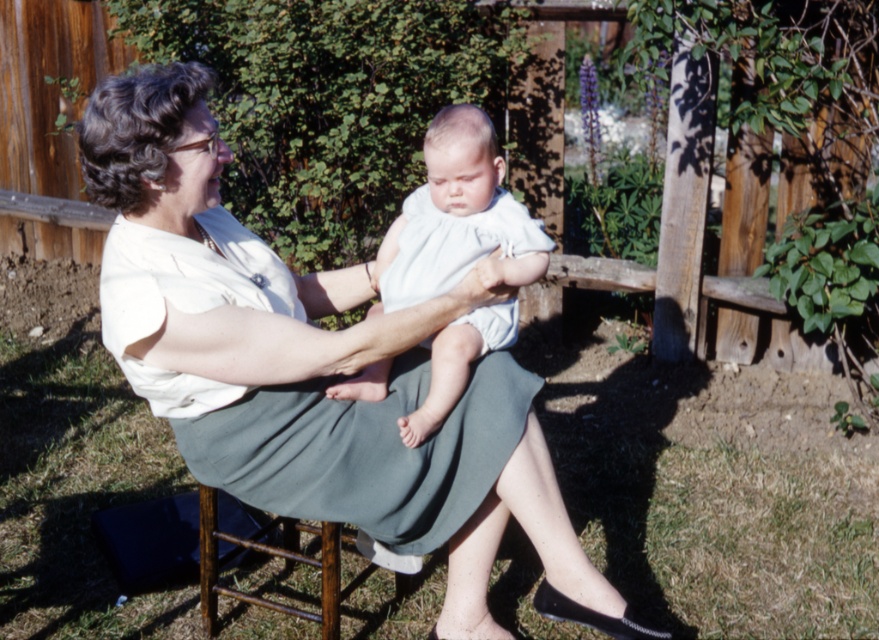
Does white cotton blouse at upper center appear under white cotton dress at center?

Correct, white cotton blouse at upper center is located below white cotton dress at center.

Can you confirm if white cotton blouse at upper center is shorter than white cotton dress at center?

Incorrect, white cotton blouse at upper center's height does not fall short of white cotton dress at center's.

Identify the location of white cotton blouse at upper center. The width and height of the screenshot is (879, 640). (313, 371).

Identify the location of white cotton blouse at upper center. (313, 371).

Based on the photo, who is positioned more to the right, white cotton blouse at upper center or light blue cotton dress at center?

From the viewer's perspective, white cotton blouse at upper center appears more on the right side.

Is point (444, 438) closer to camera compared to point (120, 337)?

That is False.

Find the location of a particular element. white cotton blouse at upper center is located at coordinates pos(313,371).

Can you confirm if light blue cotton dress at center is bigger than white cotton dress at center?

Yes, light blue cotton dress at center is bigger than white cotton dress at center.

The width and height of the screenshot is (879, 640). Describe the element at coordinates (304, 401) in the screenshot. I see `light blue cotton dress at center` at that location.

Identify the location of light blue cotton dress at center. This screenshot has height=640, width=879. (304, 401).